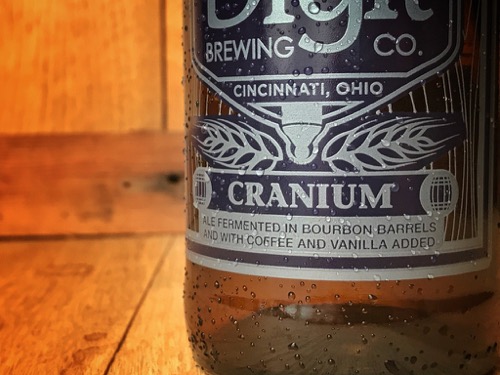
Where is `floorboards`? The width and height of the screenshot is (500, 375). floorboards is located at coordinates (140, 338), (65, 308).